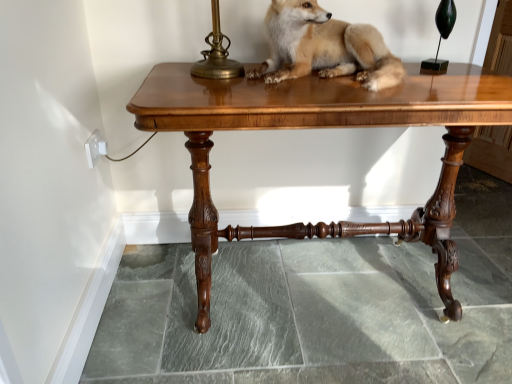
Locate an element on the screen. Image resolution: width=512 pixels, height=384 pixels. light brown fur at center is located at coordinates (324, 47).

At what (x,y) coordinates should I click in order to perform the action: click on light brown fur at center. Please return your answer as a coordinate pair (x, y). The height and width of the screenshot is (384, 512). Looking at the image, I should click on (324, 47).

From the image's perspective, which object appears higher, shiny brass table lamp at upper right or light brown fur at center?

shiny brass table lamp at upper right, from the image's perspective.

Is shiny brass table lamp at upper right not within light brown fur at center?

shiny brass table lamp at upper right is positioned outside light brown fur at center.

Would you consider shiny brass table lamp at upper right to be distant from light brown fur at center?

No, shiny brass table lamp at upper right is not far away from light brown fur at center.

Which is more to the left, shiny brass table lamp at upper right or light brown fur at center?

light brown fur at center is more to the left.

From a real-world perspective, is shiny brass table lamp at upper right located higher than glossy wood table at center?

Yes.

Who is shorter, shiny brass table lamp at upper right or glossy wood table at center?

With less height is shiny brass table lamp at upper right.

Is shiny brass table lamp at upper right positioned beyond the bounds of glossy wood table at center?

Absolutely, shiny brass table lamp at upper right is external to glossy wood table at center.

Considering the positions of objects shiny brass table lamp at upper right and glossy wood table at center in the image provided, who is in front, shiny brass table lamp at upper right or glossy wood table at center?

glossy wood table at center is in front.

At what (x,y) coordinates should I click in order to perform the action: click on dog lying below the shiny brass table lamp at upper right (from the image's perspective). Please return your answer as a coordinate pair (x, y). Image resolution: width=512 pixels, height=384 pixels. Looking at the image, I should click on (324, 47).

Would you say light brown fur at center is inside or outside shiny brass table lamp at upper right?

light brown fur at center cannot be found inside shiny brass table lamp at upper right.

Considering the positions of objects light brown fur at center and shiny brass table lamp at upper right in the image provided, who is behind, light brown fur at center or shiny brass table lamp at upper right?

shiny brass table lamp at upper right is further from the camera.

How much distance is there between light brown fur at center and shiny brass table lamp at upper right?

They are 14.83 inches apart.

Which of these two, glossy wood table at center or light brown fur at center, is bigger?

Bigger between the two is glossy wood table at center.

In terms of height, does glossy wood table at center look taller or shorter compared to light brown fur at center?

Considering their sizes, glossy wood table at center has more height than light brown fur at center.

Where is `dog located above the glossy wood table at center (from a real-world perspective)`? This screenshot has height=384, width=512. dog located above the glossy wood table at center (from a real-world perspective) is located at coordinates (324, 47).

Looking at this image, can you confirm if glossy wood table at center is positioned to the right of light brown fur at center?

In fact, glossy wood table at center is to the left of light brown fur at center.

In terms of size, does glossy wood table at center appear bigger or smaller than shiny brass table lamp at upper right?

glossy wood table at center is bigger than shiny brass table lamp at upper right.

Which is correct: glossy wood table at center is inside shiny brass table lamp at upper right, or outside of it?

glossy wood table at center is not inside shiny brass table lamp at upper right, it's outside.

Which object is more forward, glossy wood table at center or shiny brass table lamp at upper right?

glossy wood table at center is in front.

Would you consider light brown fur at center to be distant from glossy wood table at center?

No, light brown fur at center is not far from glossy wood table at center.

Looking at this image, how distant is light brown fur at center from glossy wood table at center?

The distance of light brown fur at center from glossy wood table at center is 7.78 inches.

Is light brown fur at center positioned beyond the bounds of glossy wood table at center?

Yes, light brown fur at center is outside of glossy wood table at center.

In the scene shown: Is light brown fur at center in front of or behind glossy wood table at center in the image?

Clearly, light brown fur at center is behind glossy wood table at center.

This screenshot has width=512, height=384. In order to click on table lamp above the light brown fur at center (from a real-world perspective) in this screenshot , I will do `click(441, 35)`.

The width and height of the screenshot is (512, 384). I want to click on table that is below the shiny brass table lamp at upper right (from the image's perspective), so click(x=322, y=127).

Estimate the real-world distances between objects in this image. Which object is closer to shiny brass table lamp at upper right, light brown fur at center or glossy wood table at center?

light brown fur at center lies closer to shiny brass table lamp at upper right than the other object.

Considering their positions, is light brown fur at center positioned further to glossy wood table at center than shiny brass table lamp at upper right?

shiny brass table lamp at upper right lies further to glossy wood table at center than the other object.

From the image, which object appears to be farther from light brown fur at center, shiny brass table lamp at upper right or glossy wood table at center?

shiny brass table lamp at upper right lies further to light brown fur at center than the other object.

Estimate the real-world distances between objects in this image. Which object is closer to light brown fur at center, glossy wood table at center or shiny brass table lamp at upper right?

Based on the image, glossy wood table at center appears to be nearer to light brown fur at center.

Which object lies further to the anchor point glossy wood table at center, shiny brass table lamp at upper right or light brown fur at center?

shiny brass table lamp at upper right is positioned further to the anchor glossy wood table at center.

Considering their positions, is glossy wood table at center positioned further to shiny brass table lamp at upper right than light brown fur at center?

Among the two, glossy wood table at center is located further to shiny brass table lamp at upper right.

This screenshot has width=512, height=384. In order to click on dog between shiny brass table lamp at upper right and glossy wood table at center from top to bottom in this screenshot , I will do `click(324, 47)`.